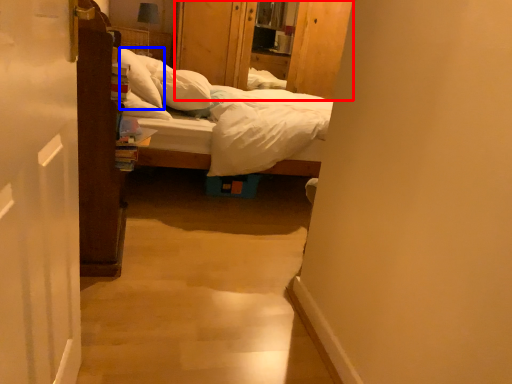
Question: Among these objects, which one is nearest to the camera, dresser (highlighted by a red box) or pillow (highlighted by a blue box)?

Choices:
 (A) dresser
 (B) pillow

Answer: (B)